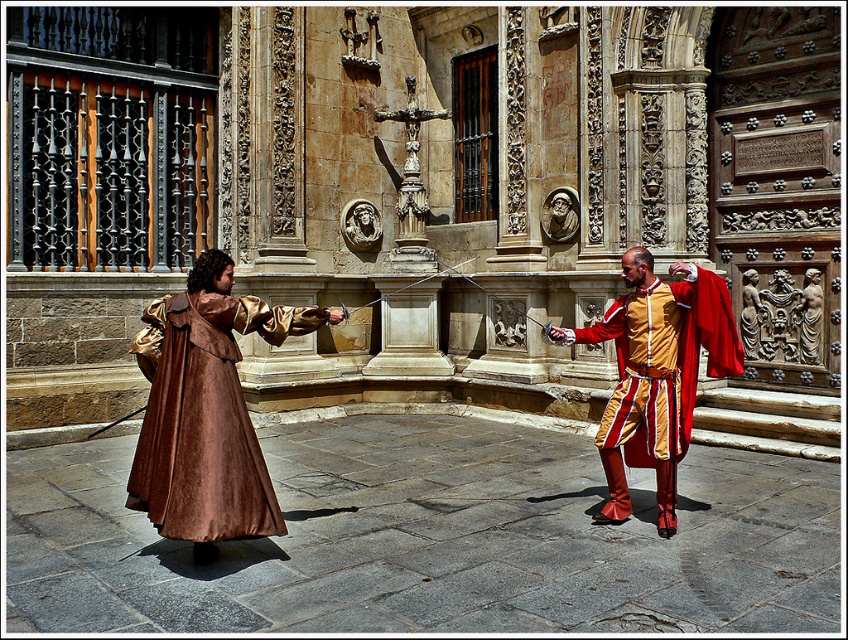
You are a costume designer preparing for a historical play. You need to decide which costume has a wider torso area to accommodate a breastplate. Which one between the brown suede cloak at center and the matte gold tunic at center is wider?

The matte gold tunic at center is wider than the brown suede cloak at center, so it can accommodate a breastplate better.

Looking at this image, you are standing at the point with coordinates point (656,305) and want to move to the entrance of the building. There is an obstacle at point (202,360). Can you walk directly towards the entrance without going around the obstacle?

Point (202,360) is in front of point (656,305), so you cannot walk directly to the entrance without going around the obstacle at point (202,360).